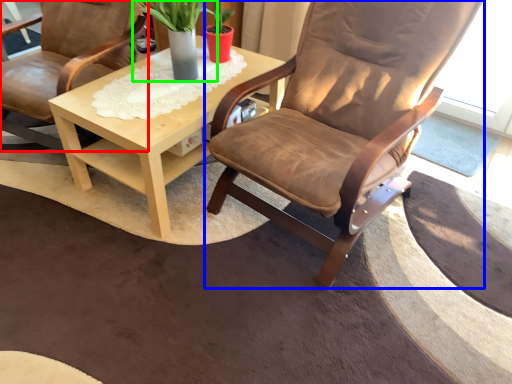
Question: Which object is the closest to the chair (highlighted by a red box)? Choose among these: chair (highlighted by a blue box) or houseplant (highlighted by a green box).

Choices:
 (A) chair
 (B) houseplant

Answer: (B)